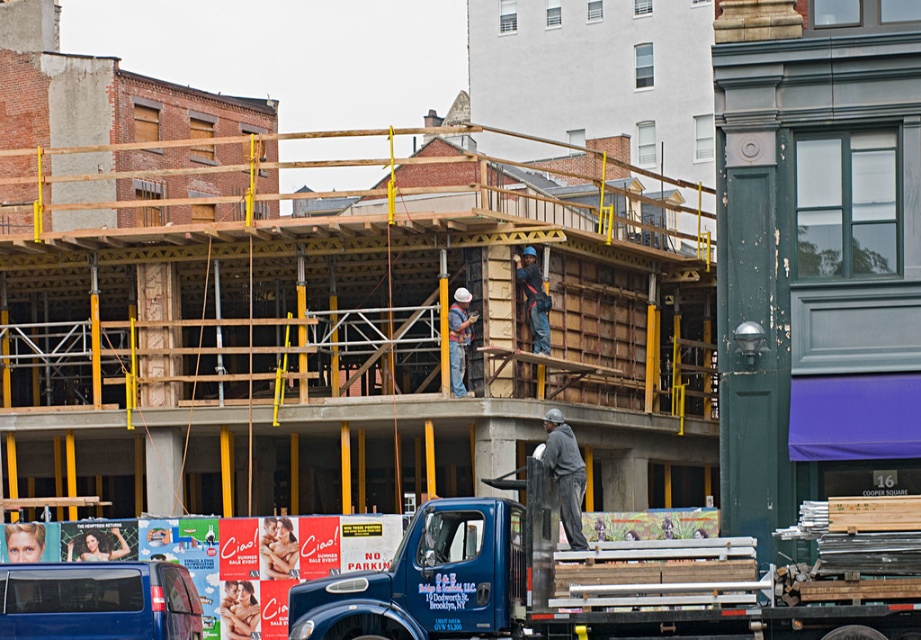
You are a drone operator trying to deliver a package to the construction site. The package must be placed at point (601,582). Based on the scene description, can you confirm if this point is on the blue metallic truck at center?

Yes, the point (601,582) is on the blue metallic truck at center according to the provided coordinates.

You are a construction supervisor who needs to direct a worker to place a safety sign between the blue matte truck at center and the matte gray hard hat at center. Based on their positions, which side of the truck should the sign be placed on?

The blue matte truck at center is to the left of the matte gray hard hat at center, so the safety sign should be placed on the right side of the blue matte truck at center to position it between the two objects.